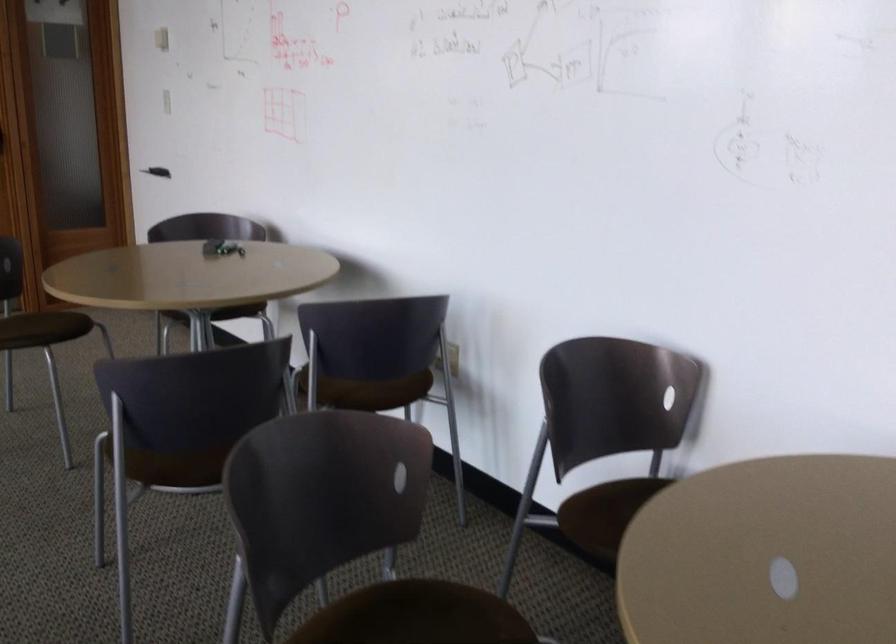
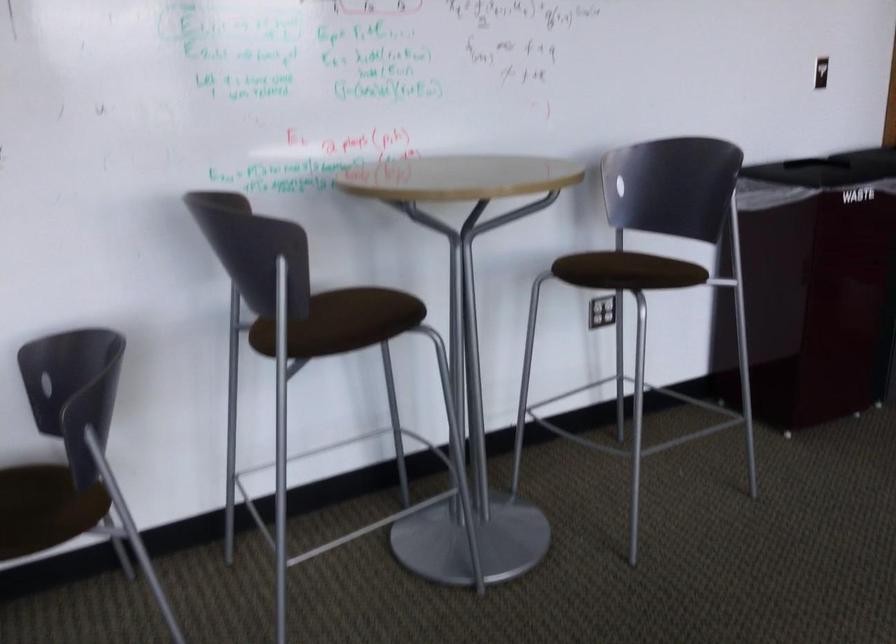
Question: How did the camera likely rotate?

Choices:
 (A) Left
 (B) Right
 (C) Up
 (D) Down

Answer: (B)